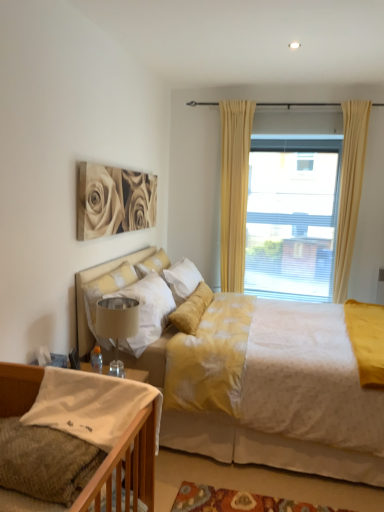
Identify the location of soft white pillow at center, the third pillow from the front. The height and width of the screenshot is (512, 384). (153, 264).

What do you see at coordinates (350, 190) in the screenshot? The width and height of the screenshot is (384, 512). I see `beige fabric curtain at upper right, the 1th curtain in the right-to-left sequence` at bounding box center [350, 190].

The width and height of the screenshot is (384, 512). I want to click on yellow fabric curtain at upper center, the 2th curtain positioned from the right, so click(234, 190).

What do you see at coordinates (234, 190) in the screenshot? I see `translucent glass window at upper center` at bounding box center [234, 190].

Find the location of a particular element. Image resolution: width=384 pixels, height=512 pixels. white cotton pillow at lower left, which is the 1th pillow from front to back is located at coordinates (45, 462).

Identify the location of white textured bed at center, placed as the 2th bed when sorted from front to back. The image size is (384, 512). click(265, 448).

How distant is beige fabric curtain at upper right, the 1th curtain in the right-to-left sequence, from translucent glass window at upper center?

beige fabric curtain at upper right, the 1th curtain in the right-to-left sequence, and translucent glass window at upper center are 36.31 inches apart.

From a real-world perspective, does beige fabric curtain at upper right, the 1th curtain in the right-to-left sequence, stand above translucent glass window at upper center?

Yes, from a real-world perspective, beige fabric curtain at upper right, the 1th curtain in the right-to-left sequence, is over translucent glass window at upper center

Are beige fabric curtain at upper right, placed as the second curtain when sorted from left to right, and translucent glass window at upper center making contact?

They are not placed beside each other.

Is point (349, 128) less distant than point (230, 199)?

Yes, it is.

Which point is more distant from viewer, (x=59, y=470) or (x=361, y=121)?

Positioned behind is point (x=361, y=121).

You are a GUI agent. You are given a task and a screenshot of the screen. Output one action in this format:
    pyautogui.click(x=<x>, y=<y>)
    Task: Click on the 3rd pillow in front of the beige fabric curtain at upper right, placed as the second curtain when sorted from left to right
    Image resolution: width=384 pixels, height=512 pixels.
    Given the screenshot: What is the action you would take?
    pyautogui.click(x=45, y=462)

From the image's perspective, would you say white cotton pillow at lower left, placed as the 1th pillow when sorted from bottom to top, is shown under beige fabric curtain at upper right, the 1th curtain in the right-to-left sequence?

Correct, white cotton pillow at lower left, placed as the 1th pillow when sorted from bottom to top, appears lower than beige fabric curtain at upper right, the 1th curtain in the right-to-left sequence, in the image.

Is white cotton pillow at lower left, the 3th pillow in the back-to-front sequence, oriented towards beige fabric curtain at upper right, the 1th curtain in the right-to-left sequence?

No.

Is translucent glass window at upper center touching white textured bed at center, placed as the 2th bed when sorted from front to back?

No, translucent glass window at upper center is not making contact with white textured bed at center, placed as the 2th bed when sorted from front to back.

Locate an element on the screen. The image size is (384, 512). window located behind the white textured bed at center, placed as the 2th bed when sorted from front to back is located at coordinates (234, 190).

Is point (241, 217) closer or farther from the camera than point (181, 434)?

Point (241, 217).

Is white textured bed at center, placed as the 2th bed when sorted from front to back, at the back of yellow fabric curtain at upper center, which is the first curtain from left to right?

No, yellow fabric curtain at upper center, which is the first curtain from left to right, is not facing away from white textured bed at center, placed as the 2th bed when sorted from front to back.

Considering the relative positions of yellow fabric curtain at upper center, the 2th curtain positioned from the right, and white textured bed at center, placed as the 2th bed when sorted from front to back, in the image provided, is yellow fabric curtain at upper center, the 2th curtain positioned from the right, to the left of white textured bed at center, placed as the 2th bed when sorted from front to back, from the viewer's perspective?

Yes.

Is yellow fabric curtain at upper center, the 2th curtain positioned from the right, situated inside white textured bed at center, placed as the 2th bed when sorted from front to back, or outside?

yellow fabric curtain at upper center, the 2th curtain positioned from the right, is located beyond the bounds of white textured bed at center, placed as the 2th bed when sorted from front to back.

Does white soft pillow at upper left, which is the second pillow in bottom-to-top order, turn towards yellow fabric curtain at upper center, the 2th curtain positioned from the right?

No, white soft pillow at upper left, which is the second pillow in bottom-to-top order, is not aimed at yellow fabric curtain at upper center, the 2th curtain positioned from the right.

Is white soft pillow at upper left, the 2th pillow viewed from the back, further to the viewer compared to yellow fabric curtain at upper center, the 2th curtain positioned from the right?

No, white soft pillow at upper left, the 2th pillow viewed from the back, is in front of yellow fabric curtain at upper center, the 2th curtain positioned from the right.

Considering the relative sizes of white soft pillow at upper left, which is the second pillow in bottom-to-top order, and yellow fabric curtain at upper center, the 2th curtain positioned from the right, in the image provided, is white soft pillow at upper left, which is the second pillow in bottom-to-top order, smaller than yellow fabric curtain at upper center, the 2th curtain positioned from the right,?

Correct, white soft pillow at upper left, which is the second pillow in bottom-to-top order, occupies less space than yellow fabric curtain at upper center, the 2th curtain positioned from the right.

What's the angular difference between white soft pillow at upper left, the 2th pillow from the top, and yellow fabric curtain at upper center, the 2th curtain positioned from the right,'s facing directions?

The angle between the facing direction of white soft pillow at upper left, the 2th pillow from the top, and the facing direction of yellow fabric curtain at upper center, the 2th curtain positioned from the right, is 89.2 degrees.

Who is taller, white textured bed at center, marked as the first bed in a back-to-front arrangement, or beige fabric lampshade at lower center?

Standing taller between the two is white textured bed at center, marked as the first bed in a back-to-front arrangement.

Looking at this image, from a real-world perspective, who is located lower, white textured bed at center, placed as the 2th bed when sorted from front to back, or beige fabric lampshade at lower center?

white textured bed at center, placed as the 2th bed when sorted from front to back, from a real-world perspective.

There is a white textured bed at center, marked as the first bed in a back-to-front arrangement. At what (x,y) coordinates should I click in order to perform the action: click on lamp above it (from a real-world perspective). Please return your answer as a coordinate pair (x, y). Image resolution: width=384 pixels, height=512 pixels. Looking at the image, I should click on (117, 325).

Considering the relative sizes of beige fabric lampshade at lower center and white cotton pillow at lower left, placed as the 1th pillow when sorted from bottom to top, in the image provided, is beige fabric lampshade at lower center bigger than white cotton pillow at lower left, placed as the 1th pillow when sorted from bottom to top,?

Correct, beige fabric lampshade at lower center is larger in size than white cotton pillow at lower left, placed as the 1th pillow when sorted from bottom to top.

Is white cotton pillow at lower left, placed as the 1th pillow when sorted from bottom to top, inside beige fabric lampshade at lower center?

Definitely not — white cotton pillow at lower left, placed as the 1th pillow when sorted from bottom to top, is not inside beige fabric lampshade at lower center.

From the image's perspective, is beige fabric lampshade at lower center under white cotton pillow at lower left, the 3th pillow in the back-to-front sequence?

No, from the image's perspective, beige fabric lampshade at lower center is not below white cotton pillow at lower left, the 3th pillow in the back-to-front sequence.

Is beige fabric lampshade at lower center wider than white cotton pillow at lower left, the 3th pillow in the back-to-front sequence?

Incorrect, the width of beige fabric lampshade at lower center does not surpass that of white cotton pillow at lower left, the 3th pillow in the back-to-front sequence.

The width and height of the screenshot is (384, 512). I want to click on curtain that is the 2nd object located in front of the translucent glass window at upper center, so click(350, 190).

Starting from the white cotton pillow at lower left, positioned as the third pillow in top-to-bottom order, which curtain is the 2nd one to the right? Please provide its 2D coordinates.

[(350, 190)]

From the image, which object appears to be farther from beige fabric lampshade at lower center, knitted fabric bed at lower left, acting as the 2th bed starting from the back, or white textured bed at center, marked as the first bed in a back-to-front arrangement?

knitted fabric bed at lower left, acting as the 2th bed starting from the back.

When comparing their distances from yellow fabric curtain at upper center, which is the first curtain from left to right, does white cotton pillow at lower left, the 3th pillow in the back-to-front sequence, or beige fabric curtain at upper right, the 1th curtain in the right-to-left sequence, seem further?

white cotton pillow at lower left, the 3th pillow in the back-to-front sequence, is positioned further to the anchor yellow fabric curtain at upper center, which is the first curtain from left to right.

Looking at the image, which one is located closer to white textured bed at center, placed as the 2th bed when sorted from front to back, beige fabric lampshade at lower center or white cotton pillow at lower left, the 3th pillow in the back-to-front sequence?

Among the two, beige fabric lampshade at lower center is located nearer to white textured bed at center, placed as the 2th bed when sorted from front to back.

From the image, which object appears to be nearer to beige fabric curtain at upper right, placed as the second curtain when sorted from left to right, soft white pillow at center, the third pillow ordered from the bottom, or white soft pillow at upper left, which is the 2th pillow in front-to-back order?

soft white pillow at center, the third pillow ordered from the bottom, is closer to beige fabric curtain at upper right, placed as the second curtain when sorted from left to right.

Which object lies nearer to the anchor point knitted fabric bed at lower left, acting as the 2th bed starting from the back, beige fabric lampshade at lower center or translucent glass window at upper center?

The object closer to knitted fabric bed at lower left, acting as the 2th bed starting from the back, is beige fabric lampshade at lower center.

Looking at the image, which one is located closer to beige fabric curtain at upper right, the 1th curtain in the right-to-left sequence, knitted fabric bed at lower left, acting as the 2th bed starting from the back, or beige fabric lampshade at lower center?

Among the two, beige fabric lampshade at lower center is located nearer to beige fabric curtain at upper right, the 1th curtain in the right-to-left sequence.

Looking at the image, which one is located closer to soft white pillow at center, which is the 1th pillow in top-to-bottom order, beige fabric curtain at upper right, placed as the second curtain when sorted from left to right, or matte beige roses at upper left?

Among the two, matte beige roses at upper left is located nearer to soft white pillow at center, which is the 1th pillow in top-to-bottom order.

When comparing their distances from matte beige roses at upper left, does beige fabric curtain at upper right, the 1th curtain in the right-to-left sequence, or yellow fabric curtain at upper center, which is the first curtain from left to right, seem closer?

yellow fabric curtain at upper center, which is the first curtain from left to right, is closer to matte beige roses at upper left.

This screenshot has width=384, height=512. What are the coordinates of `pillow positioned between matte beige roses at upper left and soft white pillow at center, the third pillow ordered from the bottom, from near to far` in the screenshot? It's located at (106, 292).

I want to click on picture frame positioned between white cotton pillow at lower left, the 3th pillow in the back-to-front sequence, and yellow fabric curtain at upper center, the 2th curtain positioned from the right, from near to far, so click(113, 201).

At what (x,y) coordinates should I click in order to perform the action: click on pillow between matte beige roses at upper left and translucent glass window at upper center. Please return your answer as a coordinate pair (x, y). Looking at the image, I should click on (153, 264).

Locate an element on the screen. lamp between white textured bed at center, marked as the first bed in a back-to-front arrangement, and soft white pillow at center, which is the 1th pillow in top-to-bottom order, along the z-axis is located at coordinates (117, 325).